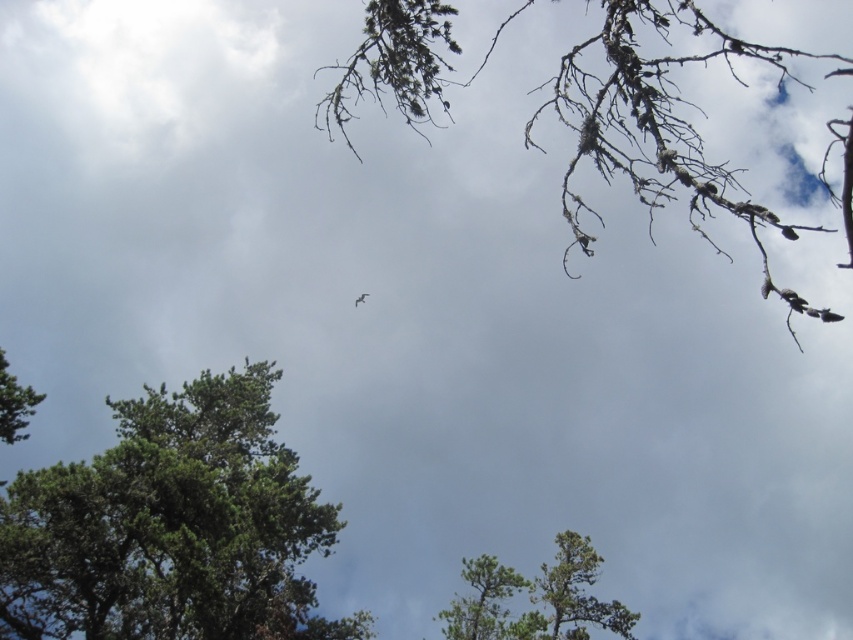
You are standing under the tree looking up at the sky. There are two points marked in the scene. The first point is at coordinates point (30, 541) and the second is at point (409, 93). Which point is closer to you?

Point (30, 541) is in front of point (409, 93), so it is closer to you.

You are standing in a forest and see the green matte tree at lower center and the green matte tree at center. Which tree is wider?

The green matte tree at center is wider than the green matte tree at lower center.